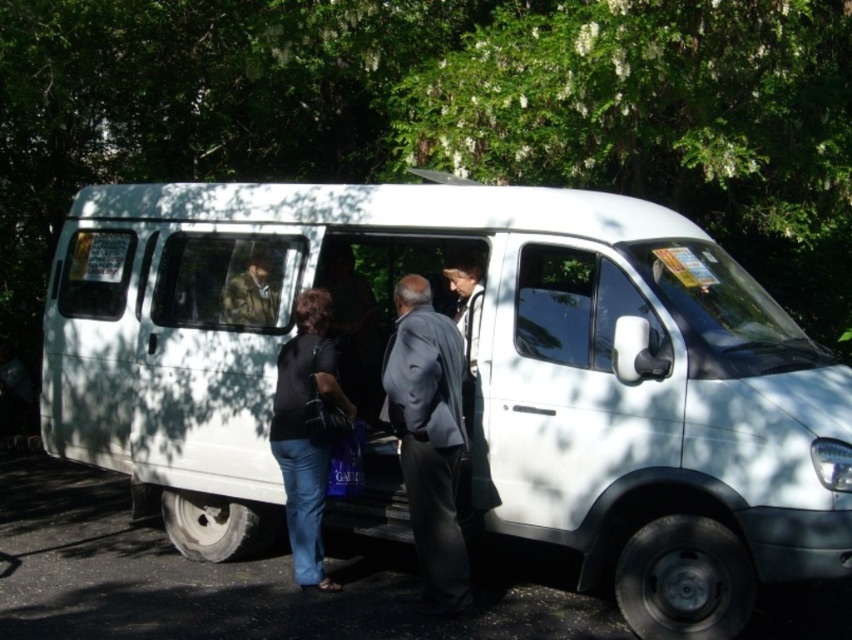
Question: Does white matte van at center come behind gray fabric suit at center?

Choices:
 (A) no
 (B) yes

Answer: (A)

Question: Can you confirm if white matte van at center is positioned to the right of camouflage fabric jacket at center?

Choices:
 (A) yes
 (B) no

Answer: (A)

Question: Which point is closer to the camera?

Choices:
 (A) (413, 506)
 (B) (240, 314)

Answer: (A)

Question: Which of the following is the closest to the observer?

Choices:
 (A) 543,337
 (B) 240,246

Answer: (A)

Question: Can you confirm if white matte van at center is wider than black matte shirt at center?

Choices:
 (A) no
 (B) yes

Answer: (B)

Question: Which point is farther to the camera?

Choices:
 (A) black matte shirt at center
 (B) white matte van at center

Answer: (A)